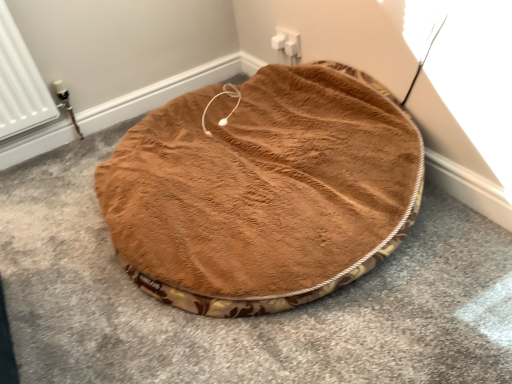
You are a GUI agent. You are given a task and a screenshot of the screen. Output one action in this format:
    pyautogui.click(x=<x>, y=<y>)
    Task: Click on the brown plush dog bed at center
    The height and width of the screenshot is (384, 512).
    Given the screenshot: What is the action you would take?
    pyautogui.click(x=263, y=190)

The width and height of the screenshot is (512, 384). Describe the element at coordinates (263, 190) in the screenshot. I see `brown plush dog bed at center` at that location.

Measure the distance between brown plush dog bed at center and camera.

A distance of 38.79 inches exists between brown plush dog bed at center and camera.

What do you see at coordinates (287, 42) in the screenshot? I see `white plastic electric outlet at upper center` at bounding box center [287, 42].

I want to click on white plastic electric outlet at upper center, so click(287, 42).

At what (x,y) coordinates should I click in order to perform the action: click on brown plush dog bed at center. Please return your answer as a coordinate pair (x, y). The height and width of the screenshot is (384, 512). Looking at the image, I should click on [263, 190].

From the picture: Can you confirm if brown plush dog bed at center is positioned to the left of white plastic electric outlet at upper center?

Indeed, brown plush dog bed at center is positioned on the left side of white plastic electric outlet at upper center.

Is brown plush dog bed at center in front of or behind white plastic electric outlet at upper center in the image?

brown plush dog bed at center is positioned closer to the viewer than white plastic electric outlet at upper center.

Considering the positions of point (296, 248) and point (287, 37), is point (296, 248) closer or farther from the camera than point (287, 37)?

Point (296, 248) is positioned closer to the camera compared to point (287, 37).

From the image's perspective, would you say brown plush dog bed at center is shown under white plastic electric outlet at upper center?

Yes, from the image's perspective, brown plush dog bed at center is below white plastic electric outlet at upper center.

From a real-world perspective, is brown plush dog bed at center positioned under white plastic electric outlet at upper center based on gravity?

Correct, in the physical world, brown plush dog bed at center is lower than white plastic electric outlet at upper center.

Between brown plush dog bed at center and white plastic electric outlet at upper center, which one has larger width?

Wider between the two is brown plush dog bed at center.

Does brown plush dog bed at center have a greater height compared to white plastic electric outlet at upper center?

Correct, brown plush dog bed at center is much taller as white plastic electric outlet at upper center.

Considering the relative sizes of brown plush dog bed at center and white plastic electric outlet at upper center in the image provided, is brown plush dog bed at center smaller than white plastic electric outlet at upper center?

No, brown plush dog bed at center is not smaller than white plastic electric outlet at upper center.

Can white plastic electric outlet at upper center be found inside brown plush dog bed at center?

No, white plastic electric outlet at upper center is not surrounded by brown plush dog bed at center.

Does brown plush dog bed at center touch white plastic electric outlet at upper center?

brown plush dog bed at center and white plastic electric outlet at upper center are clearly separated.

Is white plastic electric outlet at upper center at the back of brown plush dog bed at center?

Yes, brown plush dog bed at center's orientation is away from white plastic electric outlet at upper center.

What's the angular difference between brown plush dog bed at center and white plastic electric outlet at upper center's facing directions?

0.184 degrees separate the facing orientations of brown plush dog bed at center and white plastic electric outlet at upper center.

At what (x,y) coordinates should I click in order to perform the action: click on dog bed to the left of white plastic electric outlet at upper center. Please return your answer as a coordinate pair (x, y). The height and width of the screenshot is (384, 512). Looking at the image, I should click on (263, 190).

Considering the relative positions of white plastic electric outlet at upper center and brown plush dog bed at center in the image provided, is white plastic electric outlet at upper center to the left of brown plush dog bed at center from the viewer's perspective?

In fact, white plastic electric outlet at upper center is to the right of brown plush dog bed at center.

In the scene shown: Relative to brown plush dog bed at center, is white plastic electric outlet at upper center in front or behind?

white plastic electric outlet at upper center is positioned farther from the viewer than brown plush dog bed at center.

Which is less distant, (276, 30) or (364, 88)?

Positioned in front is point (364, 88).

From the image's perspective, is white plastic electric outlet at upper center located above brown plush dog bed at center?

Yes.

Based on the photo, from a real-world perspective, between white plastic electric outlet at upper center and brown plush dog bed at center, who is vertically lower?

brown plush dog bed at center is physically lower.

Which object is wider, white plastic electric outlet at upper center or brown plush dog bed at center?

Wider between the two is brown plush dog bed at center.

Does white plastic electric outlet at upper center have a greater height compared to brown plush dog bed at center?

In fact, white plastic electric outlet at upper center may be shorter than brown plush dog bed at center.

Between white plastic electric outlet at upper center and brown plush dog bed at center, which one has larger size?

brown plush dog bed at center.

Is white plastic electric outlet at upper center inside the boundaries of brown plush dog bed at center, or outside?

white plastic electric outlet at upper center is located beyond the bounds of brown plush dog bed at center.

Is white plastic electric outlet at upper center directly adjacent to brown plush dog bed at center?

They are not placed beside each other.

Is white plastic electric outlet at upper center oriented away from brown plush dog bed at center?

No, white plastic electric outlet at upper center is not facing away from brown plush dog bed at center.

Identify the location of dog bed below the white plastic electric outlet at upper center (from a real-world perspective). This screenshot has width=512, height=384. (263, 190).

Identify the location of electric outlet behind the brown plush dog bed at center. (287, 42).

Find the location of `electric outlet to the right of brown plush dog bed at center`. electric outlet to the right of brown plush dog bed at center is located at coordinates (287, 42).